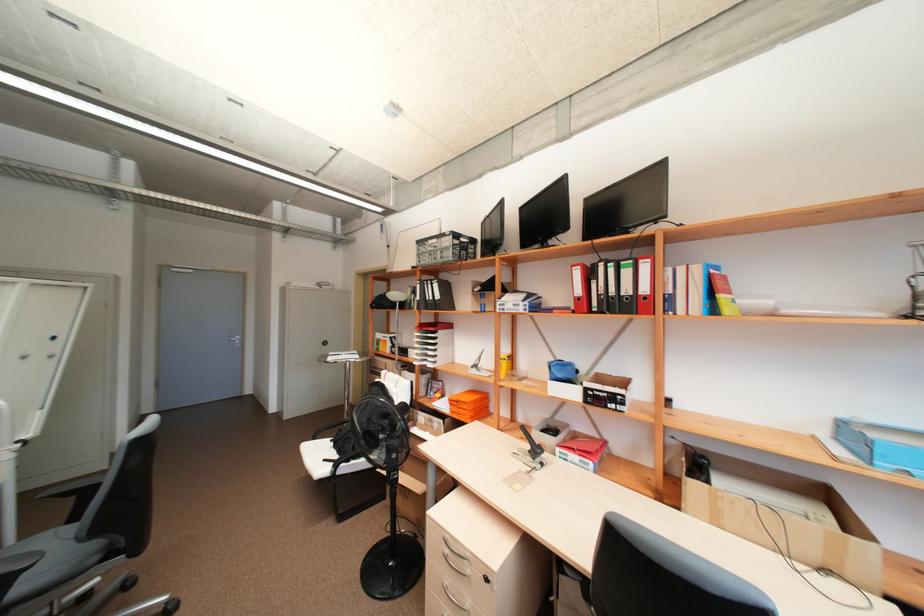
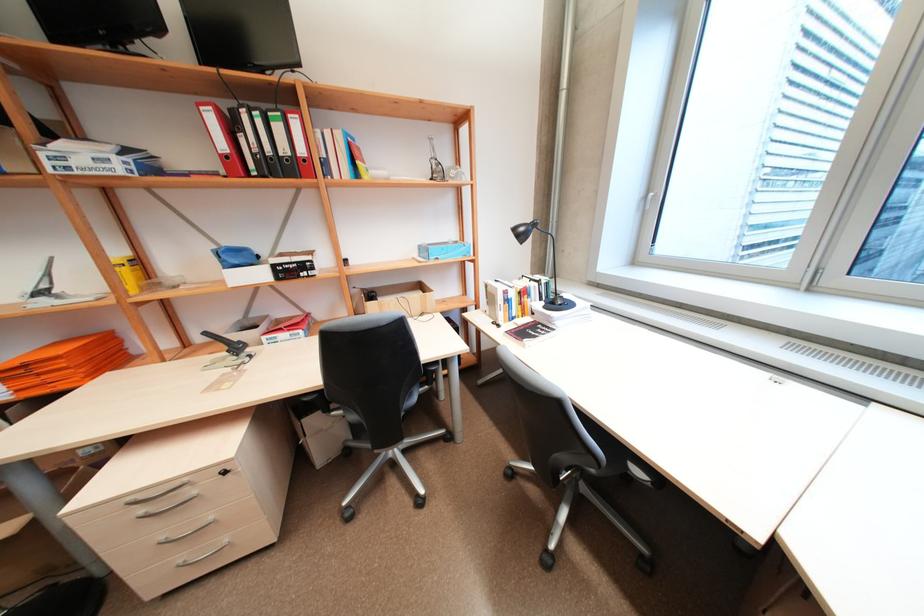
Based on the continuous images, in which direction is the camera rotating?

The rotation direction of the camera is right-down.